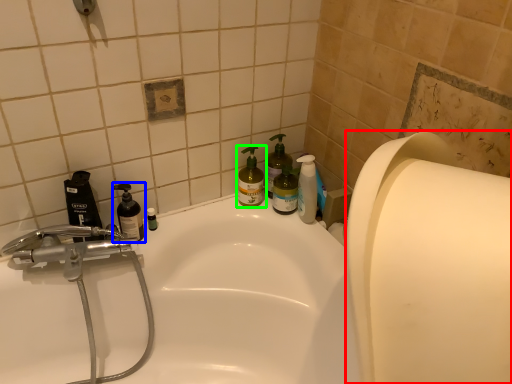
Question: Which object is the closest to the paper towel (highlighted by a red box)? Choose among these: cleaning product (highlighted by a blue box) or cleaning product (highlighted by a green box).

Choices:
 (A) cleaning product
 (B) cleaning product

Answer: (B)